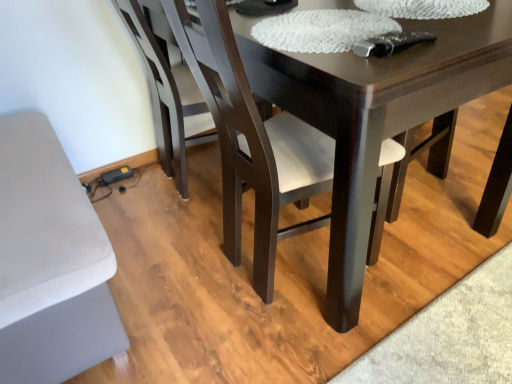
I want to click on free spot in front of dark wood chair at center, positioned as the second chair in back-to-front order, so click(307, 354).